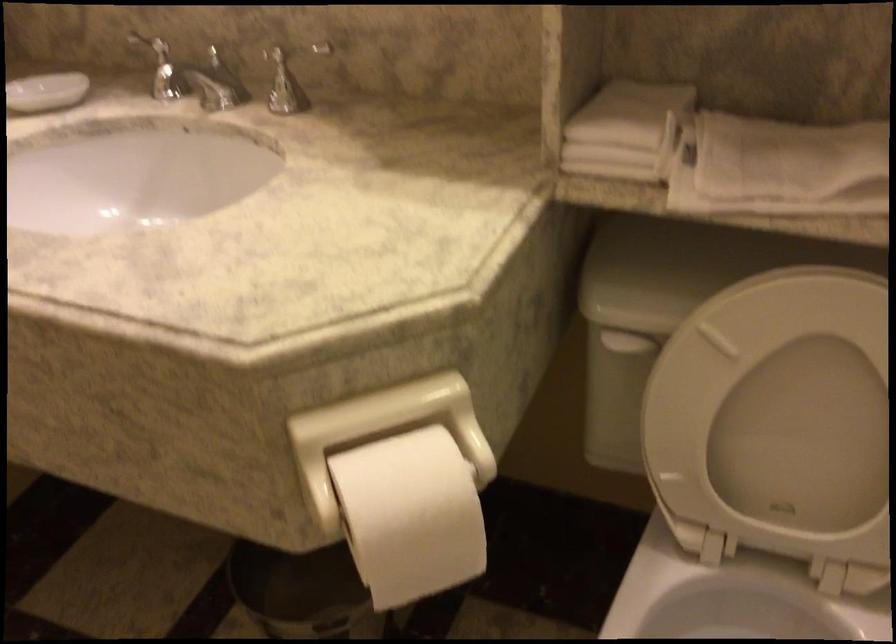
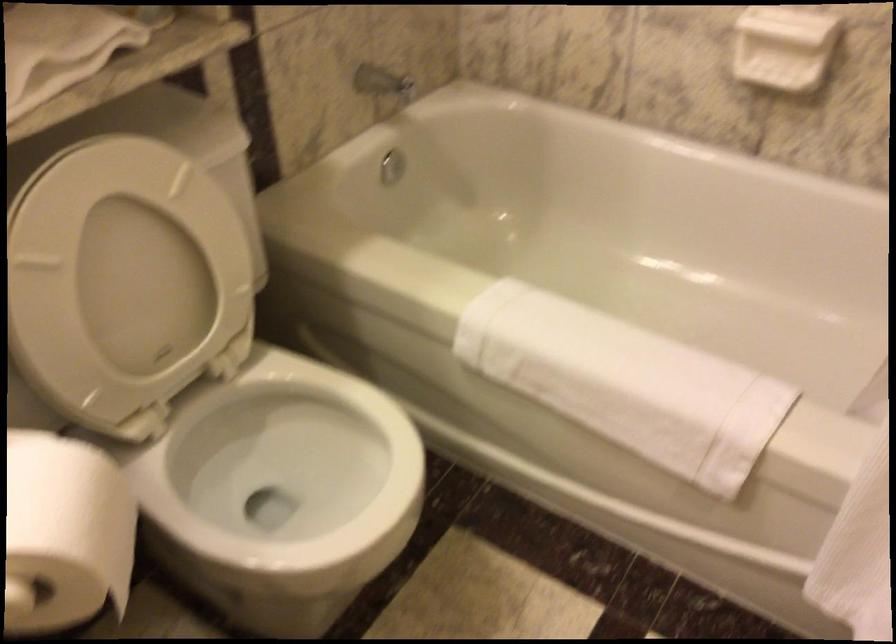
The point at (392, 506) is marked in the first image. Where is the corresponding point in the second image?

(64, 534)